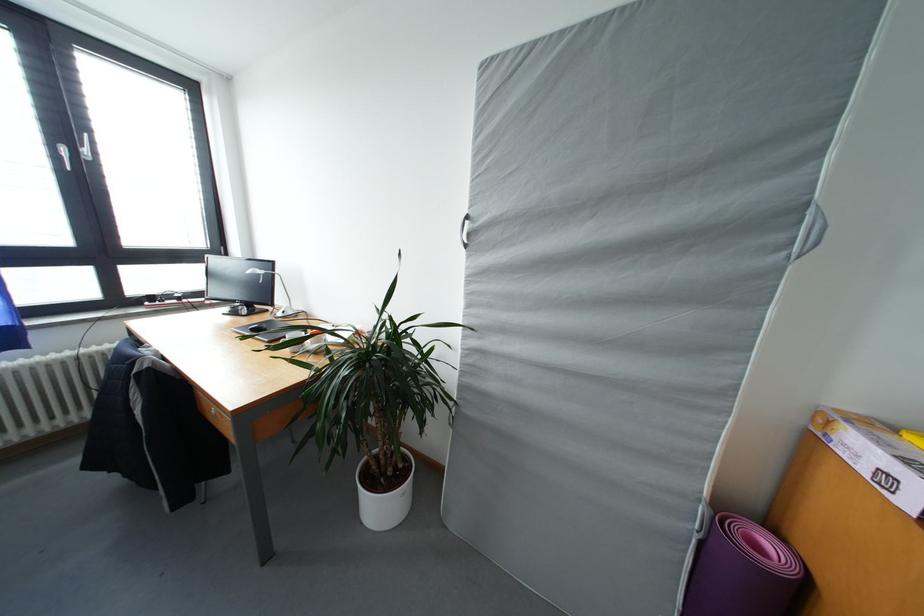
Which object does [383,496] point to?

It refers to a white plant pot.